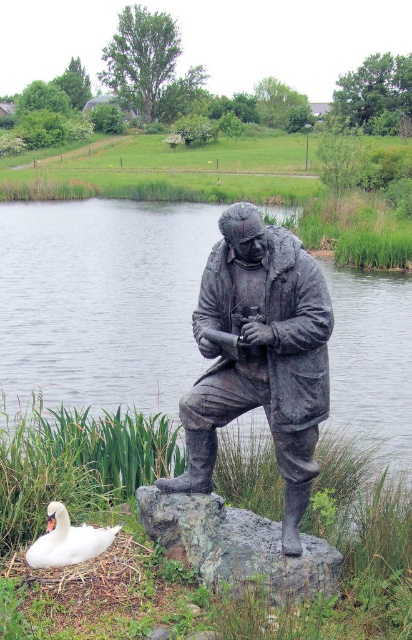
Can you confirm if rough gray rock at center is taller than white matte swan at lower left?

Correct, rough gray rock at center is much taller as white matte swan at lower left.

Based on the photo, is rough gray rock at center bigger than white matte swan at lower left?

Correct, rough gray rock at center is larger in size than white matte swan at lower left.

Which is behind, point (334, 560) or point (56, 561)?

Point (334, 560)

Identify the location of rough gray rock at center. This screenshot has height=640, width=412. (236, 547).

Is glossy water at statue right below rough gray rock at center?

No, glossy water at statue right is not below rough gray rock at center.

Is glossy water at statue right smaller than rough gray rock at center?

No, glossy water at statue right is not smaller than rough gray rock at center.

Describe the element at coordinates (102, 301) in the screenshot. The image size is (412, 640). I see `glossy water at statue right` at that location.

You are a GUI agent. You are given a task and a screenshot of the screen. Output one action in this format:
    pyautogui.click(x=<x>, y=<y>)
    Task: Click on the glossy water at statue right
    
    Given the screenshot: What is the action you would take?
    pyautogui.click(x=102, y=301)

Is bronze statue at center wider than rough gray rock at center?

Incorrect, bronze statue at center's width does not surpass rough gray rock at center's.

Measure the distance between bronze statue at center and camera.

They are 5.73 meters apart.

This screenshot has width=412, height=640. What are the coordinates of `bronze statue at center` in the screenshot? It's located at (260, 355).